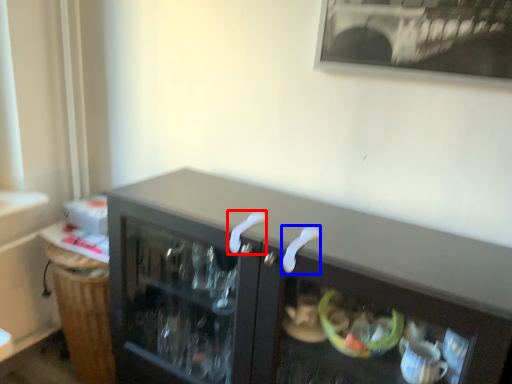
Question: Which object appears farthest to the camera in this image, door handle (highlighted by a red box) or door handle (highlighted by a blue box)?

Choices:
 (A) door handle
 (B) door handle

Answer: (A)